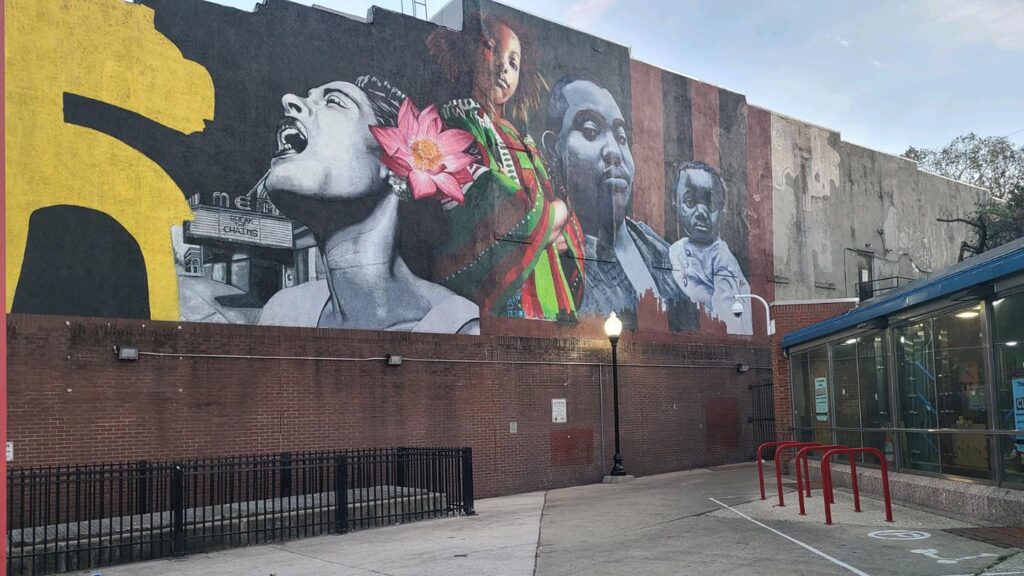
Locate an element on the screen. red brick wall is located at coordinates (84, 386), (243, 382), (378, 395), (512, 389), (582, 388), (670, 393), (715, 382).